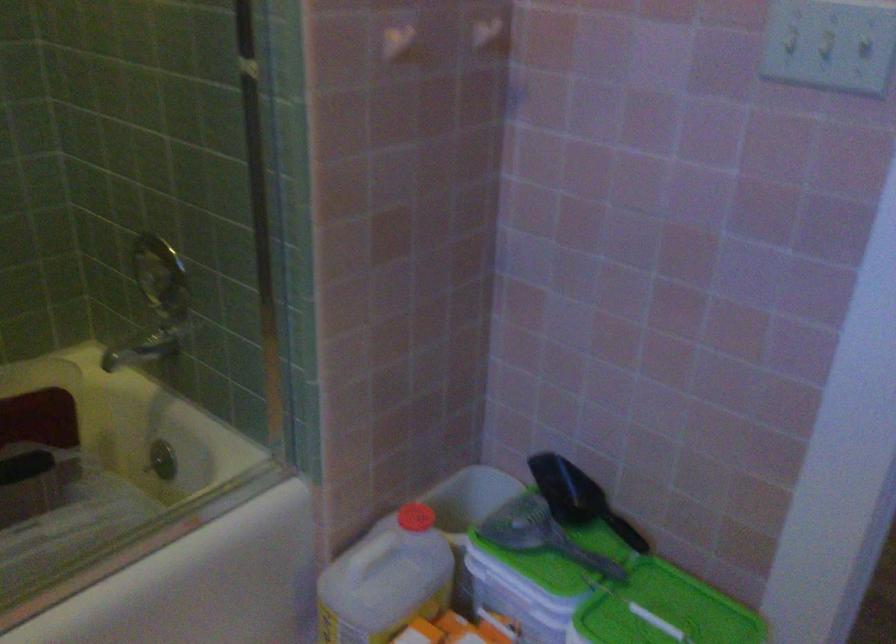
The height and width of the screenshot is (644, 896). I want to click on grey scoop handle, so (539, 534).